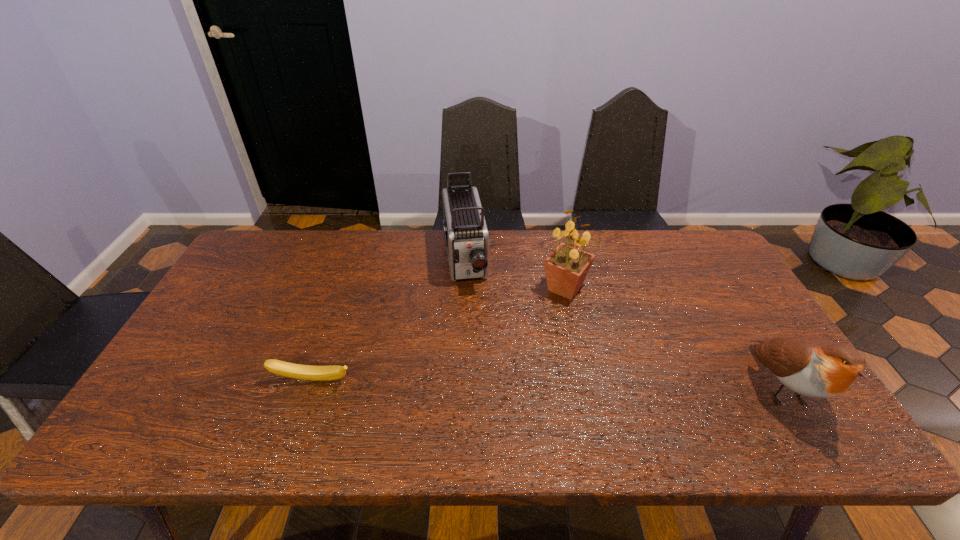
What are the coordinates of `the leftmost object` in the screenshot? It's located at (306, 372).

Image resolution: width=960 pixels, height=540 pixels. What are the coordinates of `banana` in the screenshot? It's located at (306, 372).

You are a GUI agent. You are given a task and a screenshot of the screen. Output one action in this format:
    pyautogui.click(x=<x>, y=<y>)
    Task: Click on the rightmost object
    The image size is (960, 540).
    Given the screenshot: What is the action you would take?
    pyautogui.click(x=816, y=367)

Where is `sunflower`? This screenshot has height=540, width=960. sunflower is located at coordinates (566, 268).

Identify the location of the second object from left to right. (466, 235).

At what (x,y) coordinates should I click in order to perform the action: click on vacant space located 0.280m at the front of the second object from right to left with flowers visible. Please return your answer as a coordinate pair (x, y). This screenshot has height=540, width=960. Looking at the image, I should click on (613, 384).

The height and width of the screenshot is (540, 960). I want to click on vacant region located at the front of the second object from right to left with flowers visible, so click(x=617, y=391).

Locate an element on the screen. This screenshot has width=960, height=540. vacant point located 0.210m at the front of the second object from right to left with flowers visible is located at coordinates (602, 362).

Locate an element on the screen. This screenshot has height=540, width=960. vacant space located at the lens of the second object from left to right is located at coordinates (475, 349).

Where is `vacant space located at the lens of the second object from left to right`? vacant space located at the lens of the second object from left to right is located at coordinates (476, 355).